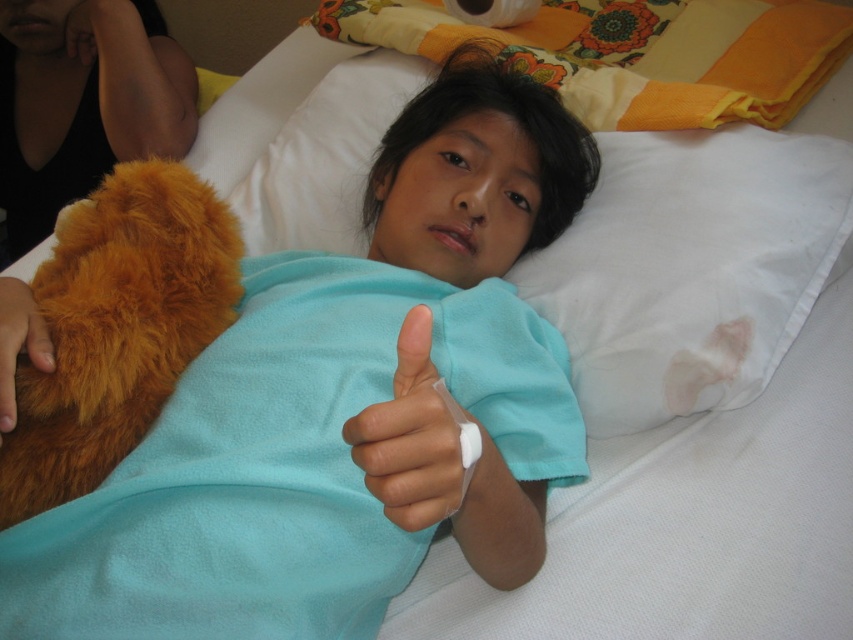
Question: Is white soft pillow at upper center in front of white plastic bandage at center?

Choices:
 (A) no
 (B) yes

Answer: (A)

Question: Is white soft pillow at upper center wider than white plastic bandage at center?

Choices:
 (A) yes
 (B) no

Answer: (A)

Question: Considering the relative positions of fuzzy orange teddy bear at left and brown fuzzy stuffed animal at left in the image provided, where is fuzzy orange teddy bear at left located with respect to brown fuzzy stuffed animal at left?

Choices:
 (A) above
 (B) below

Answer: (B)

Question: Estimate the real-world distances between objects in this image. Which object is closer to the brown fuzzy stuffed animal at left?

Choices:
 (A) brown furry hand at lower left
 (B) white soft pillow at upper center
 (C) white plastic bandage at center

Answer: (A)

Question: Which object appears closest to the camera in this image?

Choices:
 (A) white soft pillow at upper center
 (B) fuzzy orange teddy bear at left

Answer: (B)

Question: Which point is farther to the camera?

Choices:
 (A) (628, 317)
 (B) (474, 472)

Answer: (A)